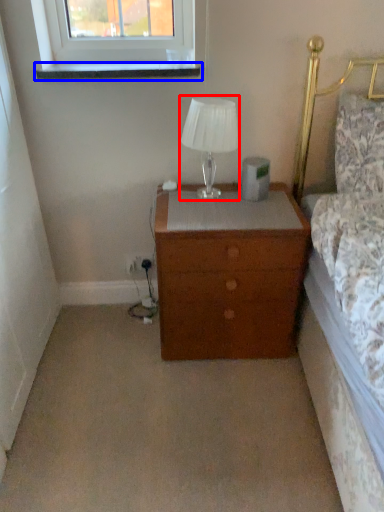
Question: Which object appears farthest to the camera in this image, table lamp (highlighted by a red box) or window sill (highlighted by a blue box)?

Choices:
 (A) table lamp
 (B) window sill

Answer: (B)